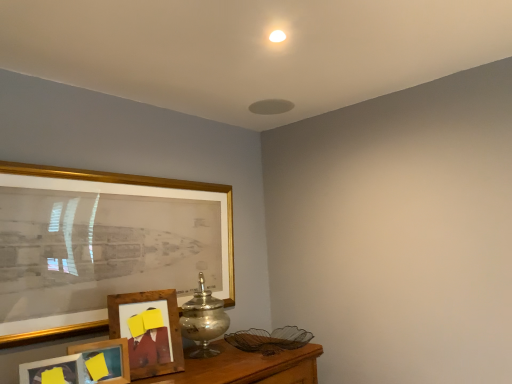
At what (x,y) coordinates should I click in order to perform the action: click on empty space that is ontop of gold framed picture at left, which is the third picture frame from front to back (from a real-world perspective). Please return your answer as a coordinate pair (x, y). This screenshot has width=512, height=384. Looking at the image, I should click on (130, 167).